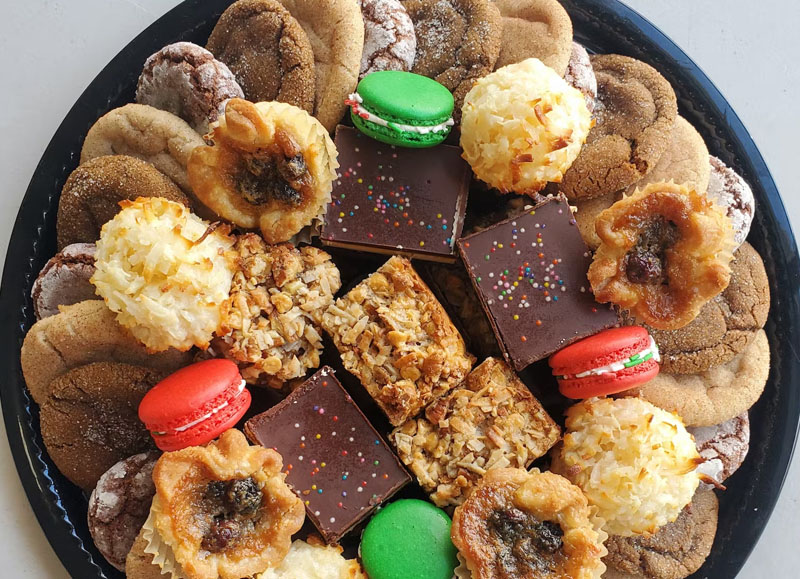
This screenshot has height=579, width=800. Find the location of `tray`. tray is located at coordinates (638, 41), (114, 67), (762, 493), (54, 522).